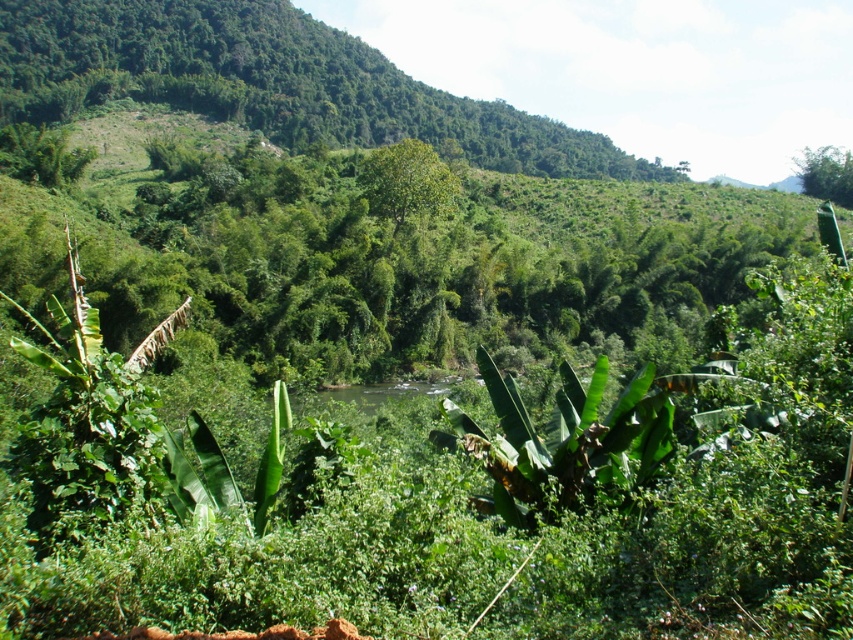
You are standing in the lush landscape and see the green leafy banana tree at center and the green leafy tree at upper right. Which tree is positioned more towards the left side of the scene?

The green leafy banana tree at center is positioned more towards the left side of the scene compared to the green leafy tree at upper right.